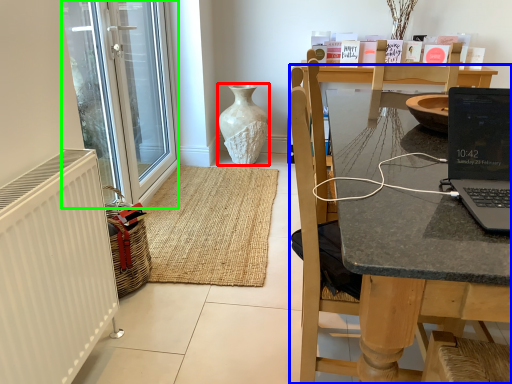
Question: Considering the real-world distances, which object is farthest from vase (highlighted by a red box)? chair (highlighted by a blue box) or glass door (highlighted by a green box)?

Choices:
 (A) chair
 (B) glass door

Answer: (A)